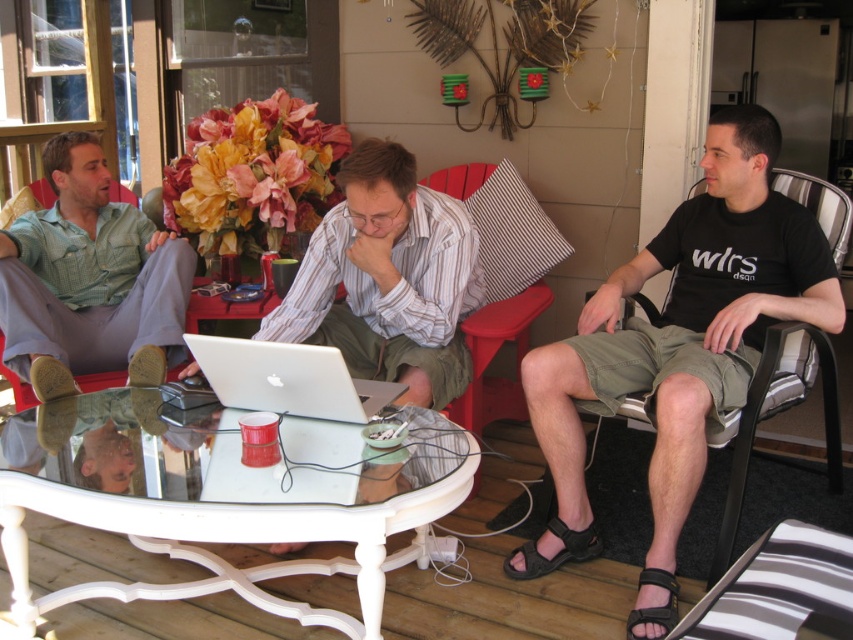
Is white glossy table at center to the left of black fabric chair at right from the viewer's perspective?

Correct, you'll find white glossy table at center to the left of black fabric chair at right.

Does white glossy table at center have a larger size compared to black fabric chair at right?

Actually, white glossy table at center might be smaller than black fabric chair at right.

Image resolution: width=853 pixels, height=640 pixels. What are the coordinates of `white glossy table at center` in the screenshot? It's located at (227, 499).

I want to click on white glossy table at center, so click(x=227, y=499).

Is white glossy table at center closer to camera compared to green checkered shirt at left?

Yes, it is in front of green checkered shirt at left.

Which is below, white glossy table at center or green checkered shirt at left?

white glossy table at center is below.

At what (x,y) coordinates should I click in order to perform the action: click on white glossy table at center. Please return your answer as a coordinate pair (x, y). Looking at the image, I should click on (227, 499).

Measure the distance between white glossy table at center and black fabric sandal at lower right.

They are 28.58 inches apart.

Based on the photo, is white glossy table at center above black fabric sandal at lower right?

Correct, white glossy table at center is located above black fabric sandal at lower right.

The height and width of the screenshot is (640, 853). In order to click on white glossy table at center in this screenshot , I will do `click(227, 499)`.